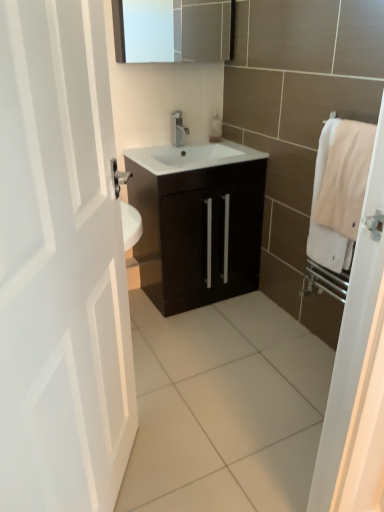
Locate an element on the screen. This screenshot has height=512, width=384. blank space to the left of translucent plastic soap dispenser at center is located at coordinates (191, 144).